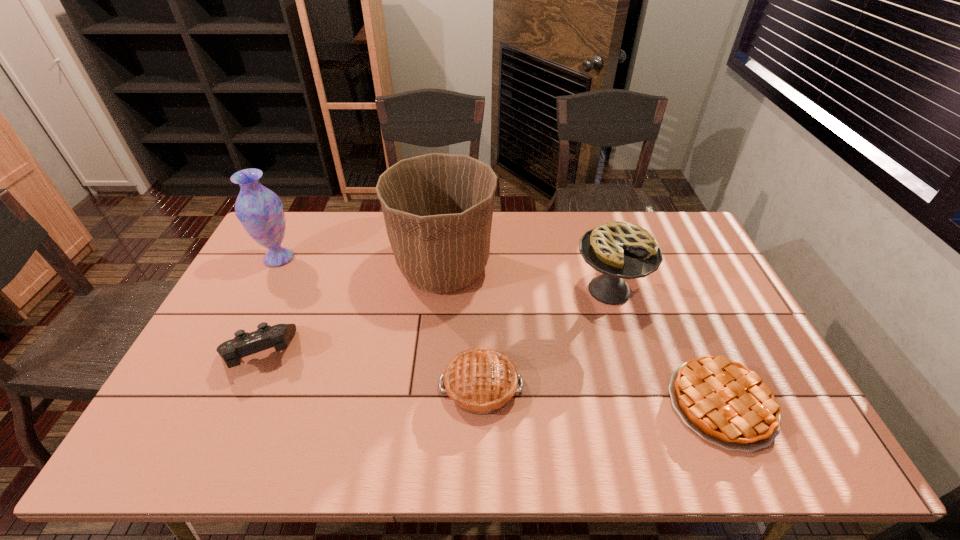
Identify which pie is the second closest to the second shortest pie. Please provide its 2D coordinates. Your answer should be formatted as a tuple, i.e. [(x, y)], where the tuple contains the x and y coordinates of a point satisfying the conditions above.

[(725, 403)]

Locate an element on the screen. pie that stands as the second closest to the leftmost pie is located at coordinates (725, 403).

Where is `vacant point that satisfies the following two spatial constraints: 1. on the front side of the shortest object; 2. on the right side of the third shortest object`? The image size is (960, 540). vacant point that satisfies the following two spatial constraints: 1. on the front side of the shortest object; 2. on the right side of the third shortest object is located at coordinates (236, 404).